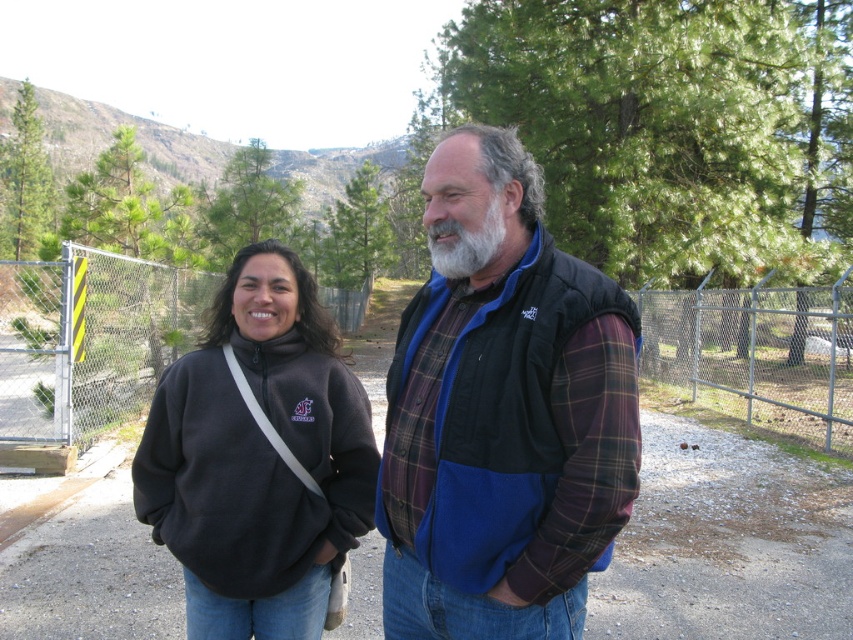
Please provide the 2D coordinates of the dark fleece sweatshirt at center in the image. The coordinates should be in the format of a tuple with two decimal numbers separated by a comma.

The 2D coordinates of the dark fleece sweatshirt at center are at point (x=259, y=458).

You are standing at the center of the image and want to throw a ball to the metal mesh fence at right without it hitting the dark fleece sweatshirt at center. Is the distance sufficient for you to make this throw?

The dark fleece sweatshirt at center is 8.98 meters away from the metal mesh fence at right. Since the ball would have to travel past the sweatshirt to reach the fence, the distance between them is sufficient for the throw as long as you aim accurately.

In the scene shown: You are a photographer trying to capture a photo of the two people in the scene. You want to ensure that the plaid fleece vest at center and the graywoollybeard at center are both clearly visible in the frame. Based on their positions, which object should you focus on first to ensure both are in focus?

The plaid fleece vest at center is to the right of graywoollybeard at center. To ensure both are in focus, you should focus on the graywoollybeard at center first since it is closer to the left side, and then adjust to include the plaid fleece vest at center on the right.